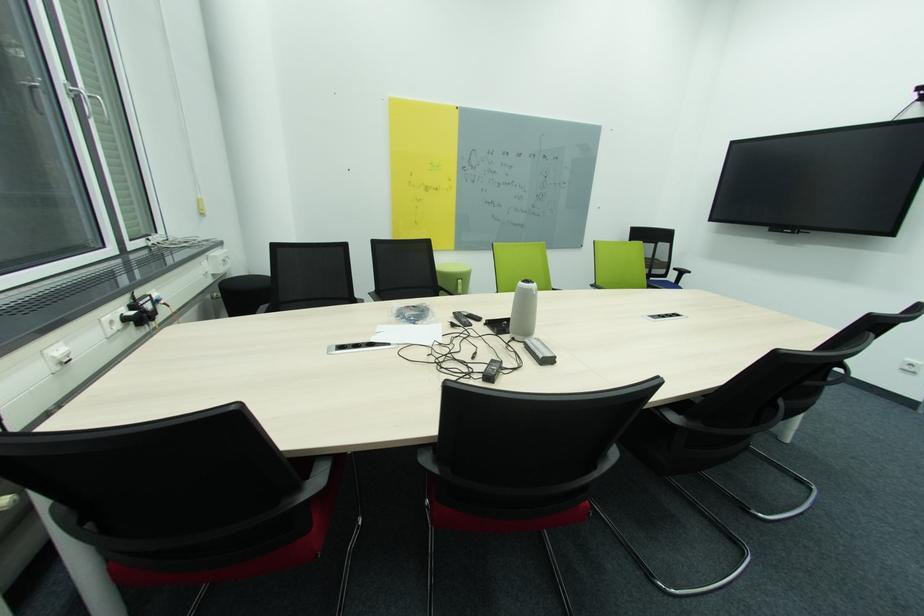
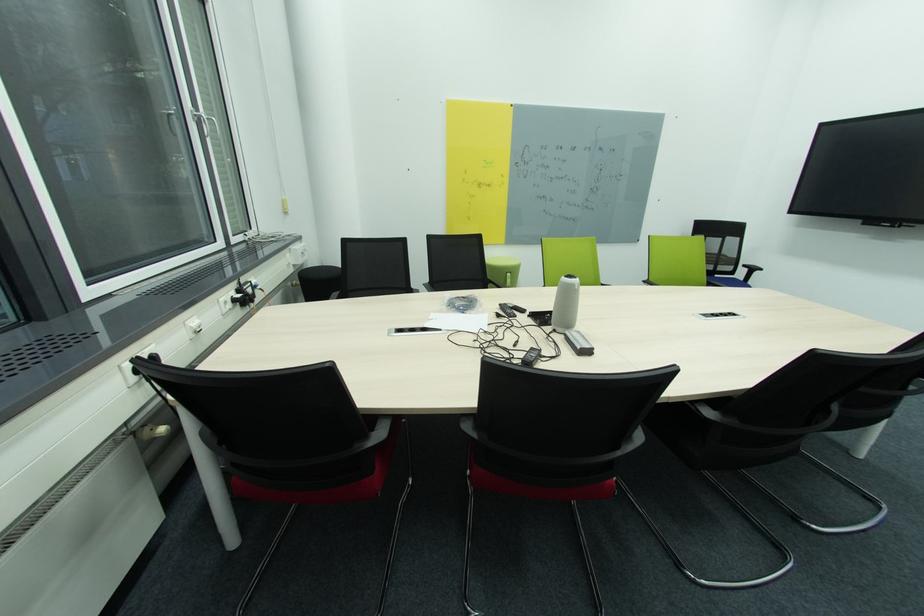
Where in the second image is the point corresponding to the point at 431,503 from the first image?

(473, 474)